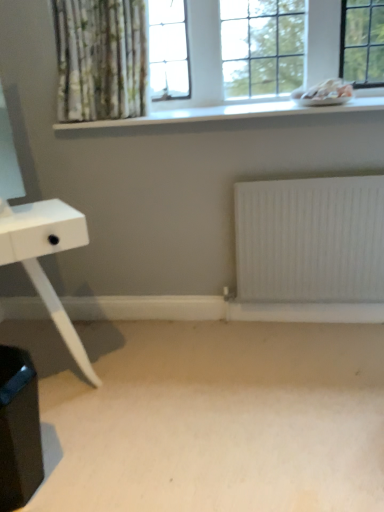
The width and height of the screenshot is (384, 512). In order to click on vacant space in front of white matte table at left in this screenshot , I will do `click(95, 465)`.